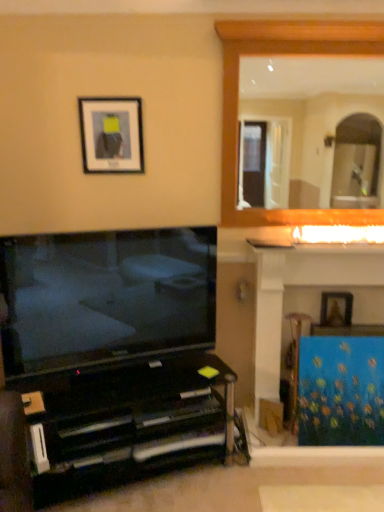
Question: Considering their positions, is blue canvas painting at right located in front of or behind wooden frame at upper right?

Choices:
 (A) front
 (B) behind

Answer: (A)

Question: From a real-world perspective, is blue canvas painting at right positioned above or below wooden frame at upper right?

Choices:
 (A) below
 (B) above

Answer: (A)

Question: Estimate the real-world distances between objects in this image. Which object is farther from the black glossy entertainment center at lower left?

Choices:
 (A) matte black picture frame at upper left, the second picture frame when ordered from right to left
 (B) wooden picture frame at upper right, which is the 2th picture frame from left to right
 (C) wooden frame at upper right
 (D) matte black tv at lower left
 (E) blue canvas painting at right

Answer: (C)

Question: Considering the real-world distances, which object is farthest from the blue fabric at right?

Choices:
 (A) black glossy entertainment center at lower left
 (B) matte black tv at lower left
 (C) blue canvas painting at right
 (D) matte black picture frame at upper left, positioned as the first picture frame in front-to-back order
 (E) wooden picture frame at upper right, which is the 2th picture frame from left to right

Answer: (D)